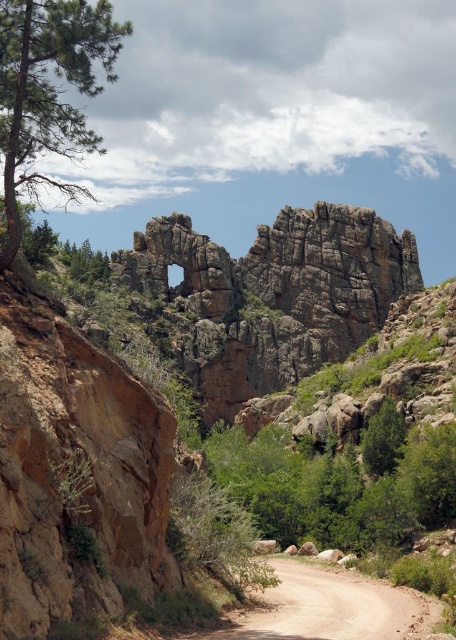
You are standing at the center of the dirt road in the scene. You want to find the green matte tree at left. Which direction should you look to find it?

The green matte tree at left is located at point (48,93), so you should look to the left side of the scene to find it.

You are a hiker trying to decide whether to take a shortcut through the green leafy tree at center or follow the brown dirt track at center. Which path is wider?

The green leafy tree at center has a larger size compared to the brown dirt track at center, so the green leafy tree at center is wider.